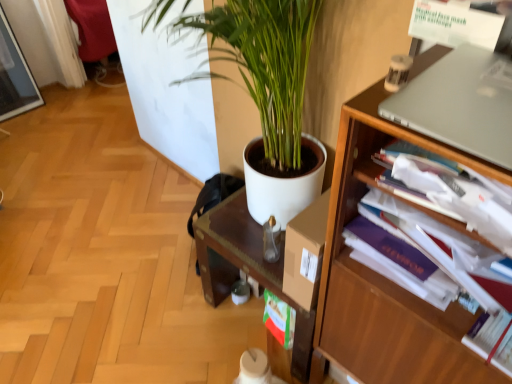
Question: Looking at their shapes, would you say white matte plant pot at center is wider or thinner than wooden bookshelf at right?

Choices:
 (A) wide
 (B) thin

Answer: (A)

Question: Based on their sizes in the image, would you say white matte plant pot at center is bigger or smaller than wooden bookshelf at right?

Choices:
 (A) big
 (B) small

Answer: (B)

Question: Which is farther from the silver metallic laptop at upper right?

Choices:
 (A) wooden bookshelf at right
 (B) purple paperback book at right
 (C) white matte plant pot at center

Answer: (C)

Question: Which object is the closest to the white matte plant pot at center?

Choices:
 (A) purple paperback book at right
 (B) silver metallic laptop at upper right
 (C) wooden bookshelf at right

Answer: (C)